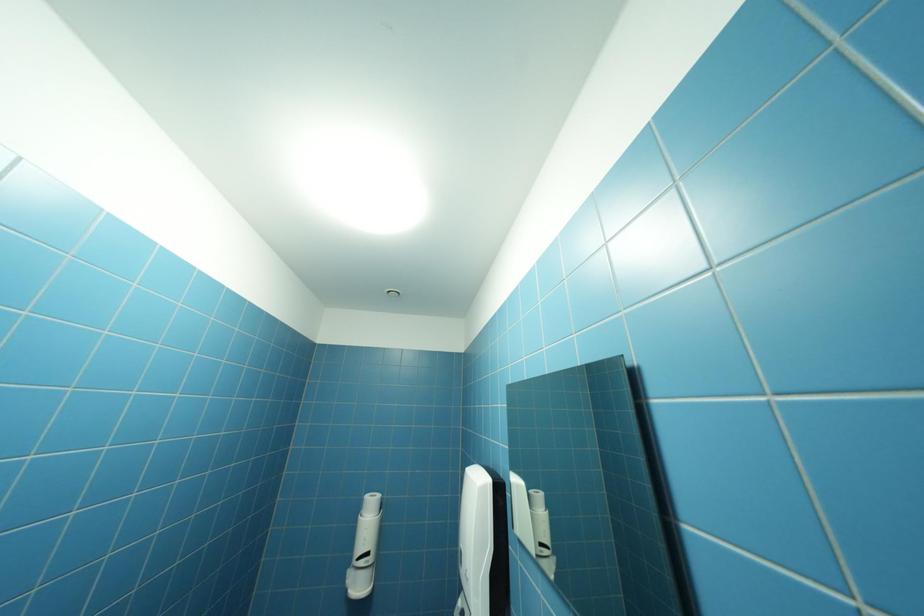
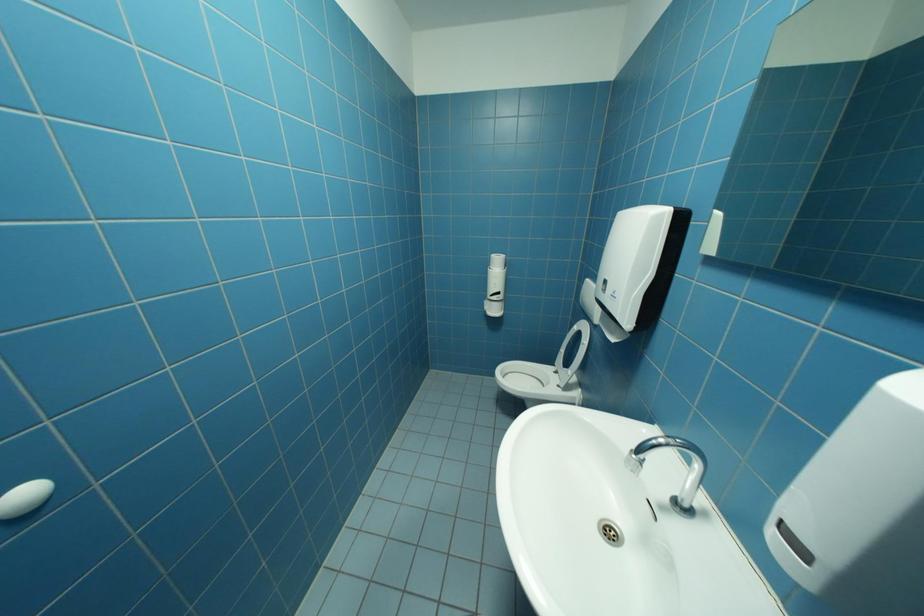
How did the camera likely rotate?

The camera rotated toward left-down.